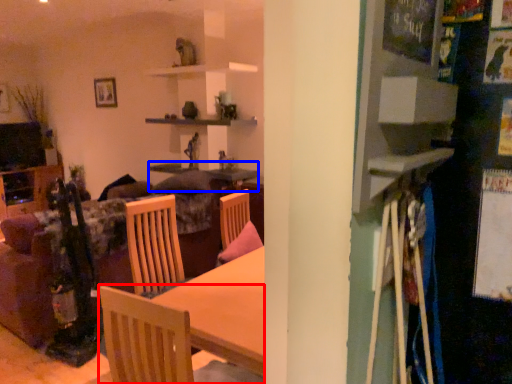
Question: Among these objects, which one is nearest to the camera, chair (highlighted by a red box) or table (highlighted by a blue box)?

Choices:
 (A) chair
 (B) table

Answer: (A)